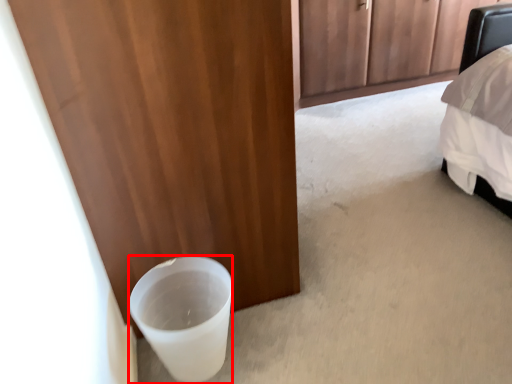
Question: From the image's perspective, what is the correct spatial relationship of beverage (annotated by the red box) in relation to door?

Choices:
 (A) above
 (B) below

Answer: (B)